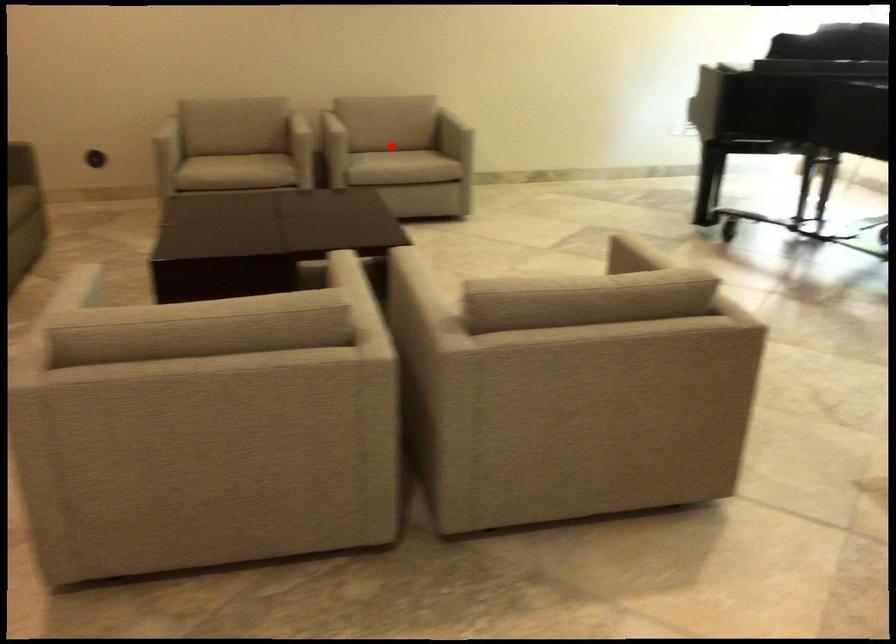
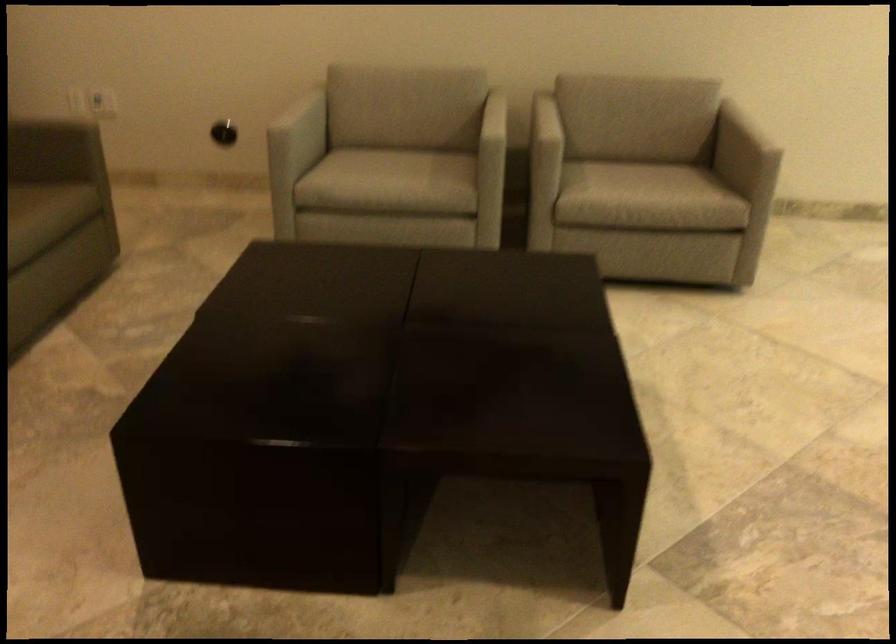
Question: I am providing you with two images of the same scene from different viewpoints. A red point is marked on the first image. At the location where the point appears in image 1, is it still visible in image 2?

Choices:
 (A) Yes
 (B) No

Answer: (A)